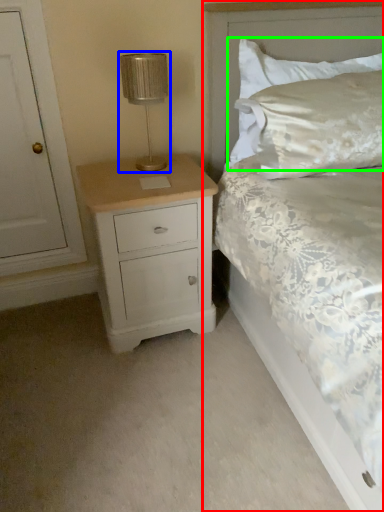
Question: Which object is positioned farthest from bed (highlighted by a red box)? Select from table lamp (highlighted by a blue box) and pillow (highlighted by a green box).

Choices:
 (A) table lamp
 (B) pillow

Answer: (A)